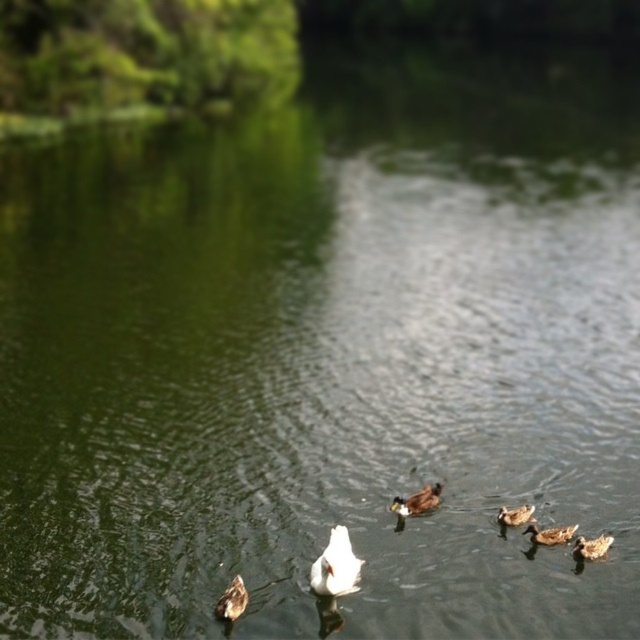
Question: Which point appears farthest from the camera in this image?

Choices:
 (A) (433, 499)
 (B) (570, 536)
 (C) (236, 608)

Answer: (A)

Question: Where is brown matte duck at center located in relation to brown matte duck at lower left in the image?

Choices:
 (A) above
 (B) below

Answer: (A)

Question: Which object is closer to the camera taking this photo?

Choices:
 (A) brown fuzzy duckling at lower right
 (B) brown matte duck at center-right
 (C) brown matte duck at lower right

Answer: (A)

Question: Can you confirm if brown matte duck at lower left is positioned to the right of brown matte duck at center-right?

Choices:
 (A) yes
 (B) no

Answer: (B)

Question: Does brown matte duck at lower left come behind brown matte duck at center-right?

Choices:
 (A) no
 (B) yes

Answer: (A)

Question: Which point is farther from the camera taking this photo?

Choices:
 (A) (595, 548)
 (B) (429, 493)
 (C) (244, 598)

Answer: (B)